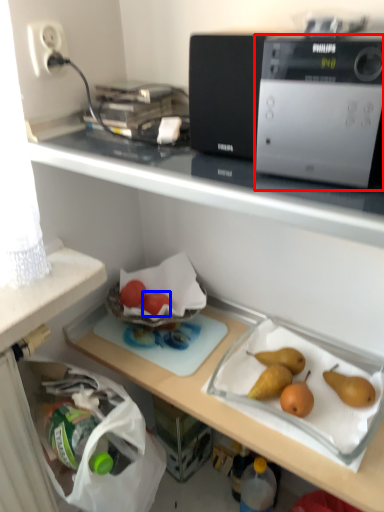
Question: Which of the following is the closest to the observer, home appliance (highlighted by a red box) or fruit (highlighted by a blue box)?

Choices:
 (A) home appliance
 (B) fruit

Answer: (A)